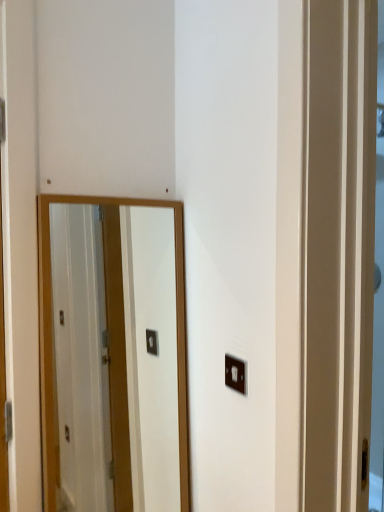
Question: Is wooden-framed mirror at center located outside matte black light switch at lower right?

Choices:
 (A) yes
 (B) no

Answer: (A)

Question: From the image's perspective, does wooden-framed mirror at center appear higher than matte black light switch at lower right?

Choices:
 (A) yes
 (B) no

Answer: (B)

Question: Is wooden-framed mirror at center looking in the opposite direction of matte black light switch at lower right?

Choices:
 (A) no
 (B) yes

Answer: (A)

Question: Is matte black light switch at lower right surrounded by wooden-framed mirror at center?

Choices:
 (A) yes
 (B) no

Answer: (B)

Question: Considering the relative positions of wooden-framed mirror at center and matte black light switch at lower right in the image provided, is wooden-framed mirror at center to the right of matte black light switch at lower right from the viewer's perspective?

Choices:
 (A) yes
 (B) no

Answer: (B)

Question: Considering the relative sizes of wooden-framed mirror at center and matte black light switch at lower right in the image provided, is wooden-framed mirror at center bigger than matte black light switch at lower right?

Choices:
 (A) yes
 (B) no

Answer: (A)

Question: Considering the relative sizes of matte black light switch at lower right and wooden-framed mirror at center in the image provided, is matte black light switch at lower right bigger than wooden-framed mirror at center?

Choices:
 (A) no
 (B) yes

Answer: (A)

Question: Considering the relative positions of matte black light switch at lower right and wooden-framed mirror at center in the image provided, is matte black light switch at lower right behind wooden-framed mirror at center?

Choices:
 (A) no
 (B) yes

Answer: (B)

Question: Can you confirm if matte black light switch at lower right is thinner than wooden-framed mirror at center?

Choices:
 (A) no
 (B) yes

Answer: (B)

Question: From the image's perspective, is matte black light switch at lower right located beneath wooden-framed mirror at center?

Choices:
 (A) yes
 (B) no

Answer: (B)

Question: Can you confirm if matte black light switch at lower right is wider than wooden-framed mirror at center?

Choices:
 (A) yes
 (B) no

Answer: (B)

Question: Is wooden-framed mirror at center completely or partially inside matte black light switch at lower right?

Choices:
 (A) yes
 (B) no

Answer: (B)

Question: Choose the correct answer: Is matte black light switch at lower right inside wooden-framed mirror at center or outside it?

Choices:
 (A) inside
 (B) outside

Answer: (B)